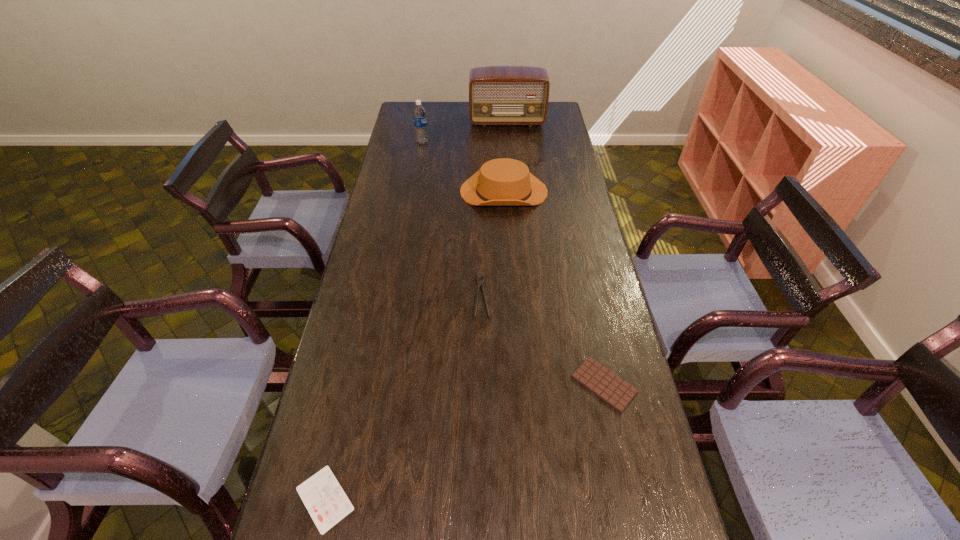
Where is `object that is at the far edge`? object that is at the far edge is located at coordinates (498, 95).

The image size is (960, 540). In order to click on water bottle that is positioned at the left edge in this screenshot , I will do `click(419, 114)`.

Locate an element on the screen. The height and width of the screenshot is (540, 960). diary that is at the left edge is located at coordinates (322, 495).

What are the coordinates of `radio receiver located at the right edge` in the screenshot? It's located at (498, 95).

You are a GUI agent. You are given a task and a screenshot of the screen. Output one action in this format:
    pyautogui.click(x=<x>, y=<y>)
    Task: Click on the cowboy hat present at the right edge
    
    Given the screenshot: What is the action you would take?
    pyautogui.click(x=503, y=181)

Locate an element on the screen. This screenshot has height=540, width=960. chocolate bar that is positioned at the right edge is located at coordinates (609, 387).

Find the location of a particular element. The image size is (960, 540). object at the far right corner is located at coordinates (498, 95).

Identify the location of vacant space at the left edge. This screenshot has width=960, height=540. pos(314,534).

Locate an element on the screen. vacant space at the right edge is located at coordinates click(x=568, y=309).

Find the location of a particular element. vacant area between the water bottle and the fourth farthest object is located at coordinates (452, 219).